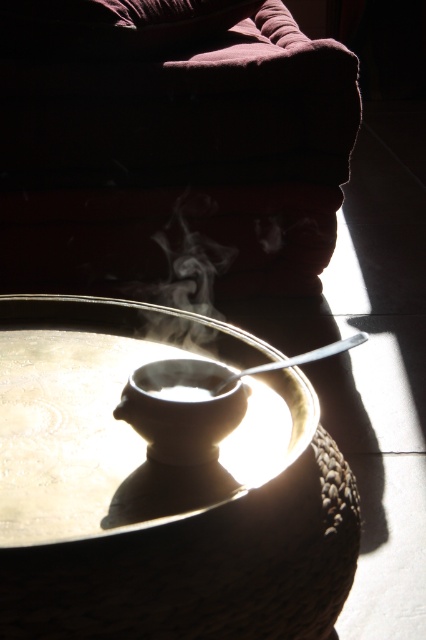
The width and height of the screenshot is (426, 640). Describe the element at coordinates (178, 164) in the screenshot. I see `velvet-like couch at upper center` at that location.

Locate an element on the screen. The height and width of the screenshot is (640, 426). velvet-like couch at upper center is located at coordinates (178, 164).

Does point (94, 168) come farther from viewer compared to point (13, 492)?

Yes, point (94, 168) is farther from viewer.

Looking at this image, which is below, velvet-like couch at upper center or white glossy saucer at center?

white glossy saucer at center is lower down.

Does point (2, 177) come behind point (31, 381)?

Yes, point (2, 177) is farther from viewer.

Find the location of a particular element. velvet-like couch at upper center is located at coordinates (178, 164).

Between white glossy saucer at center and white matte coffee cup at center, which one has less height?

white matte coffee cup at center

In the scene shown: Is white glossy saucer at center positioned in front of white matte coffee cup at center?

Yes, white glossy saucer at center is closer to the viewer.

You are a GUI agent. You are given a task and a screenshot of the screen. Output one action in this format:
    pyautogui.click(x=<x>, y=<y>)
    Task: Click on the white glossy saucer at center
    This screenshot has height=640, width=426.
    Given the screenshot: What is the action you would take?
    pyautogui.click(x=124, y=419)